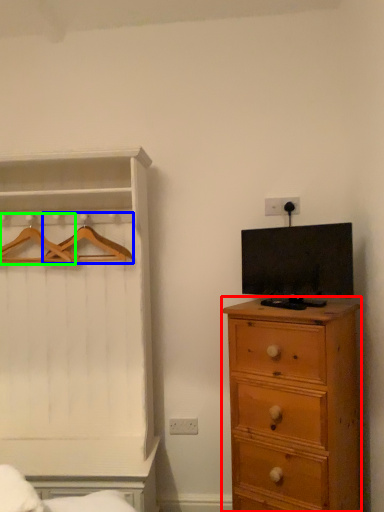
Question: Estimate the real-world distances between objects in this image. Which object is farther from chest of drawers (highlighted by a red box), hanger (highlighted by a blue box) or hanger (highlighted by a green box)?

Choices:
 (A) hanger
 (B) hanger

Answer: (B)